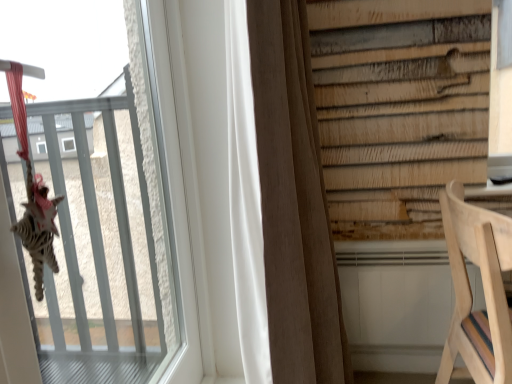
Question: Does brown fabric curtain at center turn towards transparent glass window at upper left?

Choices:
 (A) no
 (B) yes

Answer: (A)

Question: Can you confirm if brown fabric curtain at center is shorter than transparent glass window at upper left?

Choices:
 (A) yes
 (B) no

Answer: (B)

Question: Is brown fabric curtain at center positioned with its back to transparent glass window at upper left?

Choices:
 (A) no
 (B) yes

Answer: (A)

Question: From a real-world perspective, is brown fabric curtain at center on top of transparent glass window at upper left?

Choices:
 (A) yes
 (B) no

Answer: (B)

Question: Considering the relative sizes of brown fabric curtain at center and transparent glass window at upper left in the image provided, is brown fabric curtain at center bigger than transparent glass window at upper left?

Choices:
 (A) yes
 (B) no

Answer: (A)

Question: Is brown fabric curtain at center to the right of transparent glass window at upper left from the viewer's perspective?

Choices:
 (A) yes
 (B) no

Answer: (A)

Question: Is natural wood chair at lower right positioned with its back to brown fabric curtain at center?

Choices:
 (A) yes
 (B) no

Answer: (A)

Question: From a real-world perspective, is natural wood chair at lower right located beneath brown fabric curtain at center?

Choices:
 (A) no
 (B) yes

Answer: (B)

Question: Considering the relative sizes of natural wood chair at lower right and brown fabric curtain at center in the image provided, is natural wood chair at lower right shorter than brown fabric curtain at center?

Choices:
 (A) no
 (B) yes

Answer: (B)

Question: Is natural wood chair at lower right thinner than brown fabric curtain at center?

Choices:
 (A) no
 (B) yes

Answer: (A)

Question: Does natural wood chair at lower right have a greater width compared to brown fabric curtain at center?

Choices:
 (A) yes
 (B) no

Answer: (A)

Question: Is the position of natural wood chair at lower right less distant than that of brown fabric curtain at center?

Choices:
 (A) yes
 (B) no

Answer: (A)

Question: Is natural wood chair at lower right further to the viewer compared to transparent glass window at upper left?

Choices:
 (A) yes
 (B) no

Answer: (A)